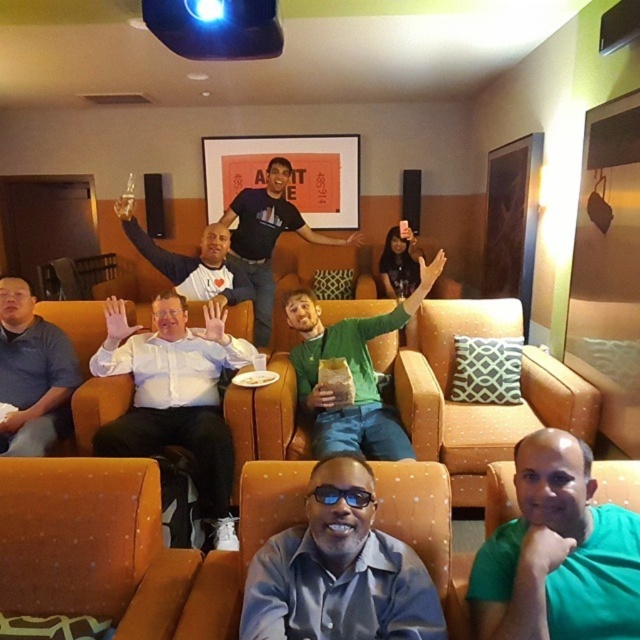
You are standing in the home theater and want to place a small decorative item between the two points, point (138,445) and point (332,504). Which point should the item be closer to in order to be closer to the camera?

The item should be closer to point (138,445) because it is further to the camera than point (332,504).